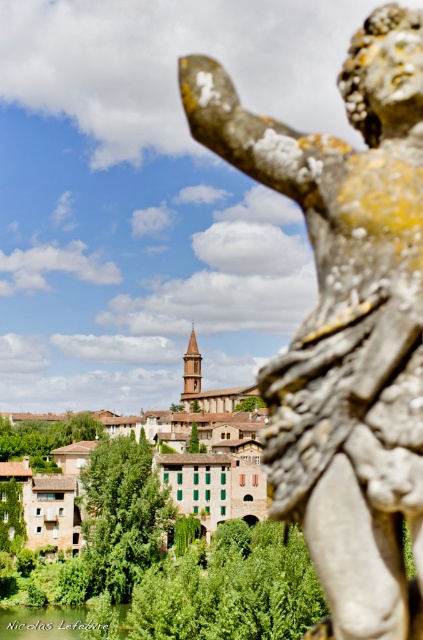
You are a tourist standing in the historic town and want to take a photo of the brown stone buildings at center. The camera you have can only focus on objects within a 0.3 unit radius from the point specified by coordinates. Is the point at coordinates (159, 465) within that focus range to capture the brown stone buildings at center?

The point at coordinates (159, 465) is on the brown stone buildings at center, so yes, the camera can focus on the brown stone buildings at center as the point is within the required radius.